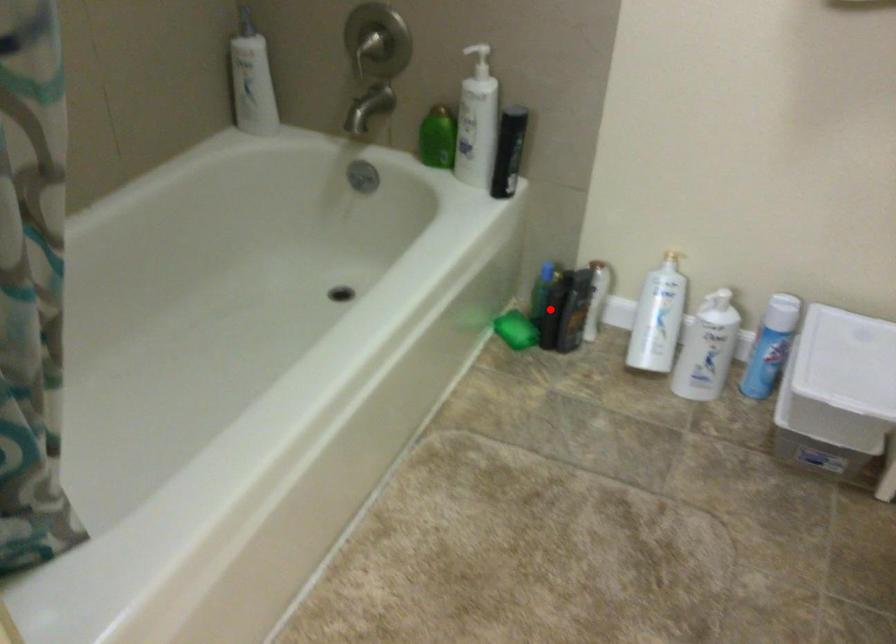
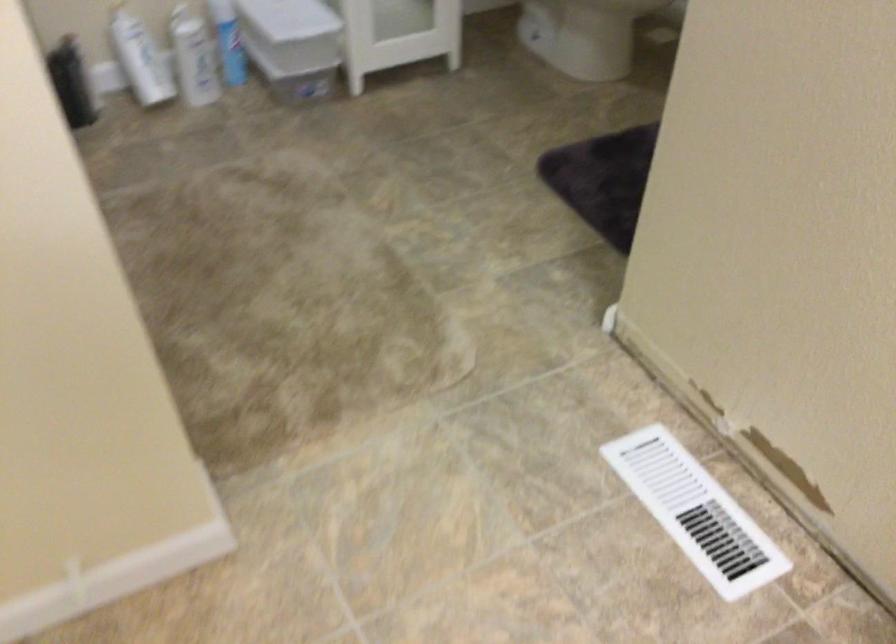
Question: A red point is marked in image1. In image2, is the corresponding 3D point closer to the camera or farther? Reply with the corresponding letter.

Choices:
 (A) The corresponding 3D point is closer.
 (B) The corresponding 3D point is farther.

Answer: (B)